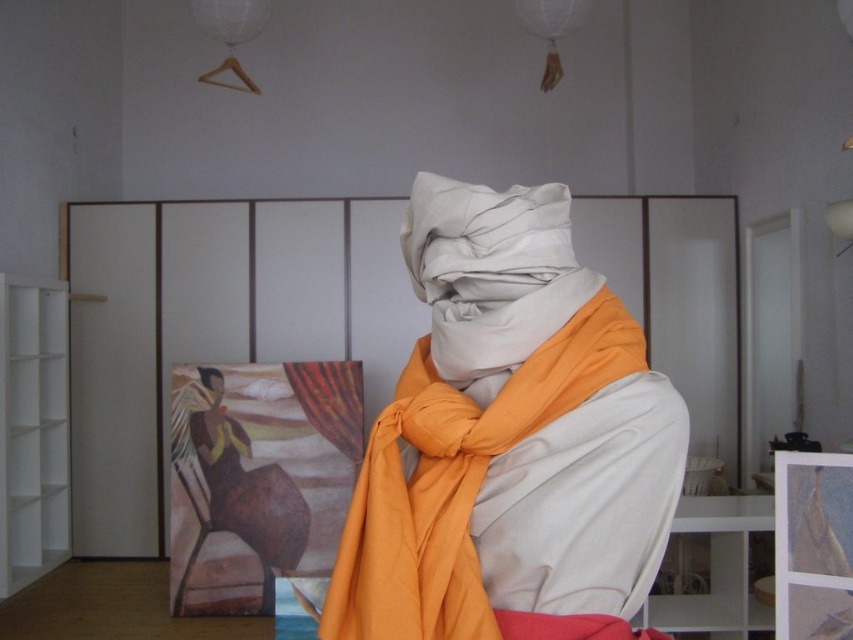
You are standing in the art studio and want to move from the point at coordinates point (431,218) to the point at coordinates point (206,387). Can you walk directly between them without any obstacles?

Point (431,218) is in front of point (206,387), so there is an obstacle blocking the path between them. You cannot walk directly between them without encountering an obstruction.

You are an artist trying to place a small sticker exactly at the point with coordinates [473,410] in the image. According to the description, where should you place the sticker?

The point with coordinates [473,410] is on the matte white scarf at center, so you should place the sticker there.

You are an artist trying to decide which scarf to use for your next sculpture. The matte white scarf at center and the matte orange scarf at center are both in front of you. Which scarf has a greater width?

The matte white scarf at center has a greater width than the matte orange scarf at center according to the description.